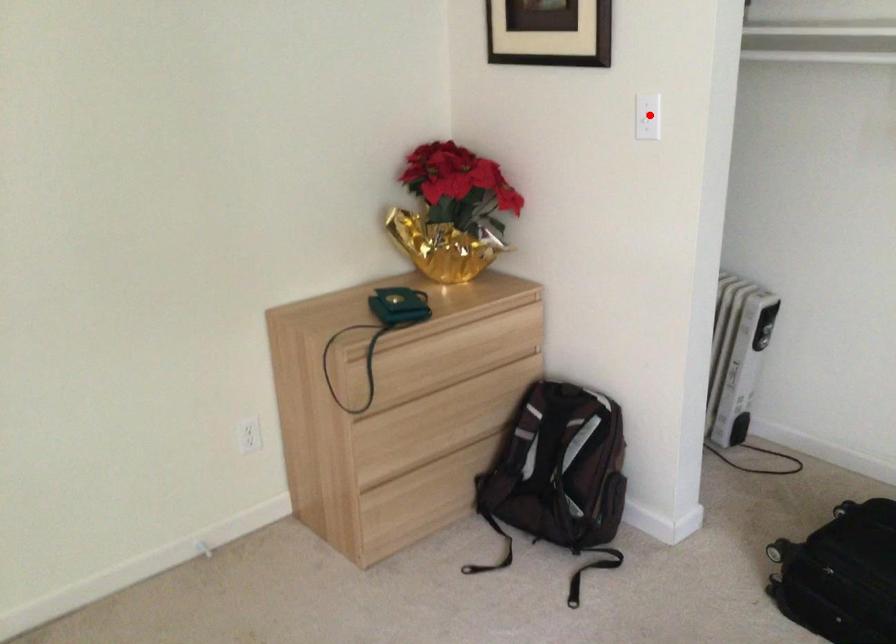
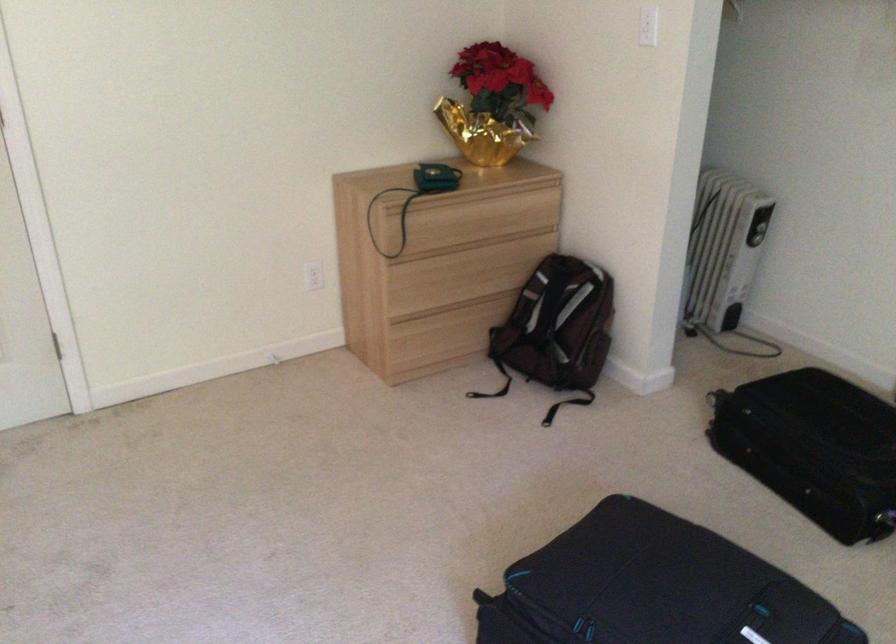
Locate, in the second image, the point that corresponds to the highlighted location in the first image.

(648, 26)